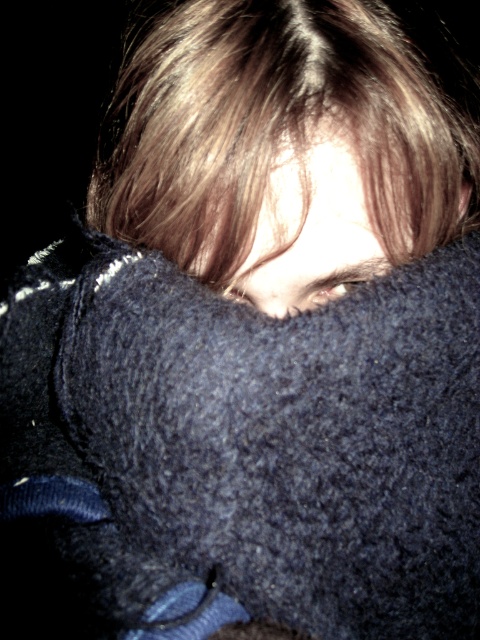
Between dark blue fuzzy head at center and smooth brown hair at center, which one has less height?

Standing shorter between the two is smooth brown hair at center.

Which is behind, point (206, 189) or point (282, 237)?

Point (282, 237)

This screenshot has width=480, height=640. Identify the location of dark blue fuzzy head at center. (283, 148).